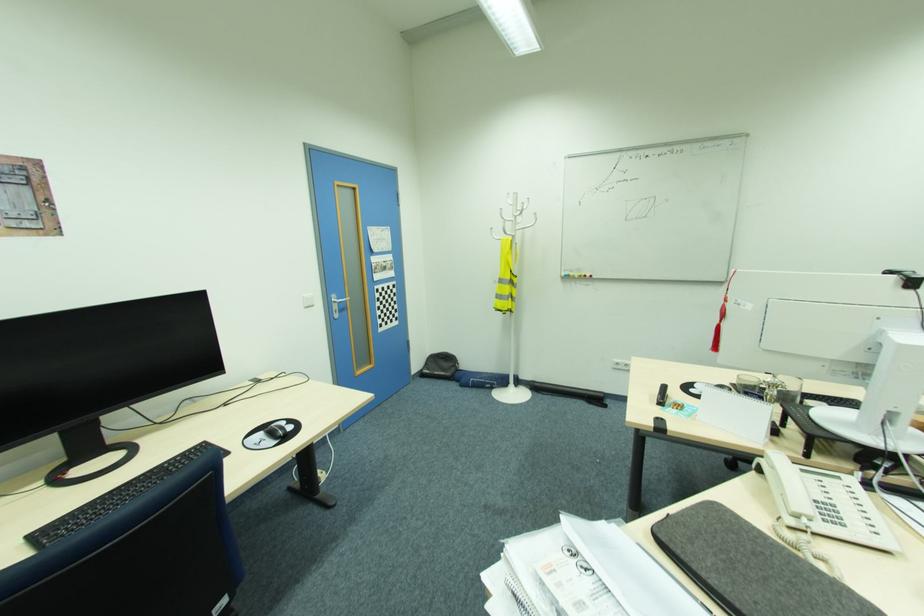
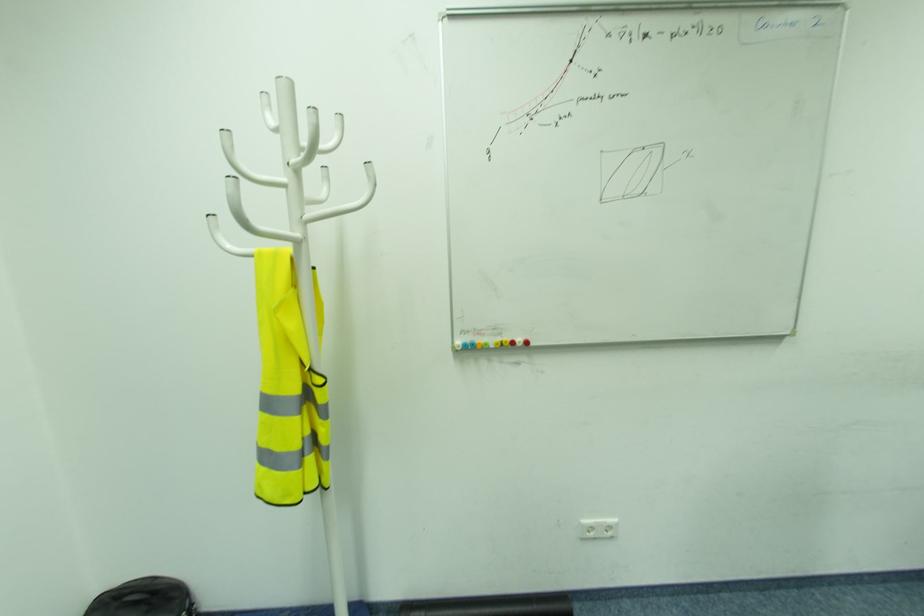
Question: Which direction would the cameraman need to move to produce the second image? Reply with the corresponding letter.

Choices:
 (A) Left
 (B) Right
 (C) Forward
 (D) Backward

Answer: (C)